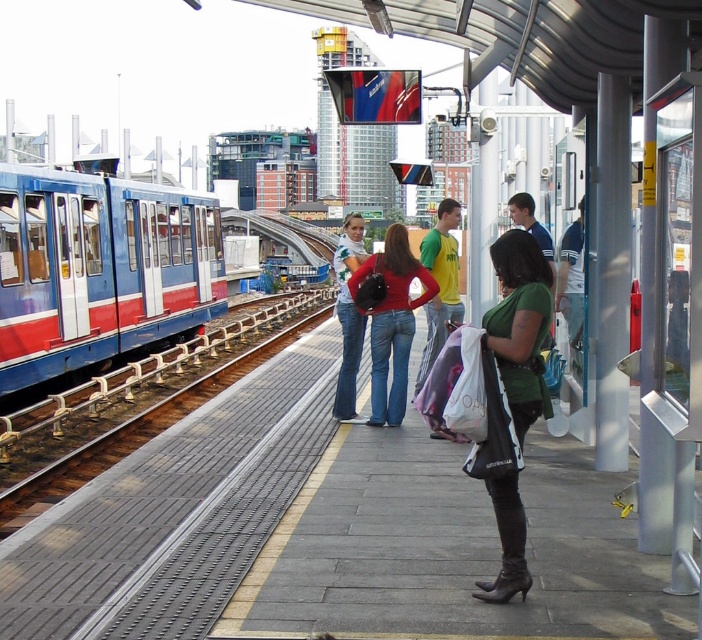
Does point (59, 468) come in front of point (366, 264)?

No, it is behind (366, 264).

Identify the location of metal/textured train track at left. The height and width of the screenshot is (640, 702). (133, 429).

Which is more to the right, green leather jacket at center or matte red sweater at center?

From the viewer's perspective, green leather jacket at center appears more on the right side.

Is green leather jacket at center further to camera compared to matte red sweater at center?

That is False.

The image size is (702, 640). What are the coordinates of `green leather jacket at center` in the screenshot? It's located at (439, 280).

Does metal/textured train track at left have a lesser height compared to leather high-heeled boot at lower center?

No.

Between metal/textured train track at left and leather high-heeled boot at lower center, which one is positioned lower?

Positioned lower is leather high-heeled boot at lower center.

Identify the location of metal/textured train track at left. The image size is (702, 640). (133, 429).

Locate an element on the screen. The image size is (702, 640). metal/textured train track at left is located at coordinates (133, 429).